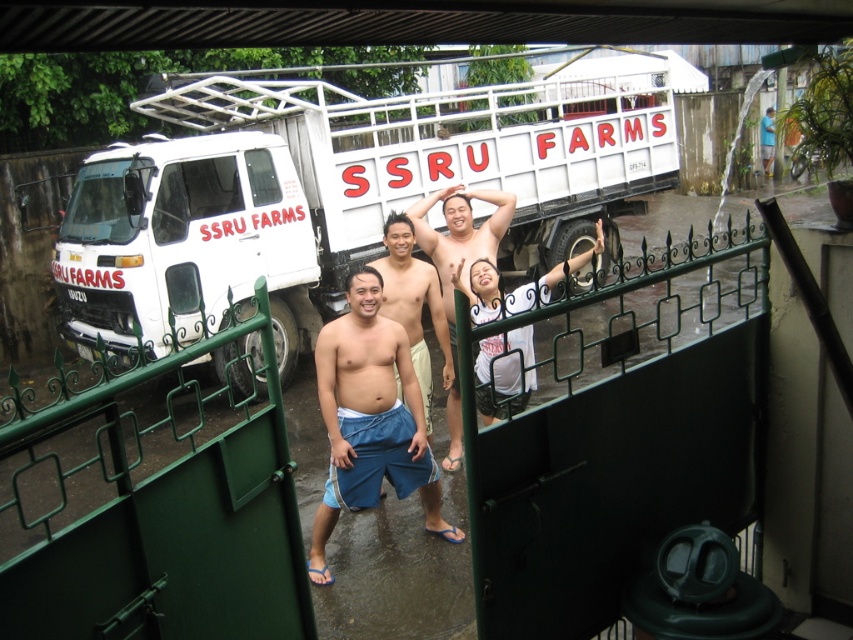
You are standing in front of the truck and want to reach both the point at coordinates point (96,240) and point (534,280). Which point is closer to you?

The point at coordinates point (96,240) is closer to you because it is further to the viewer than point (534,280).

You are a photographer standing at the origin point of the coordinate system. You want to take a photo of the blue cotton shorts at center. What are the coordinates where you should aim your camera?

The coordinates to aim the camera are at point (370, 419) to capture the blue cotton shorts at center.